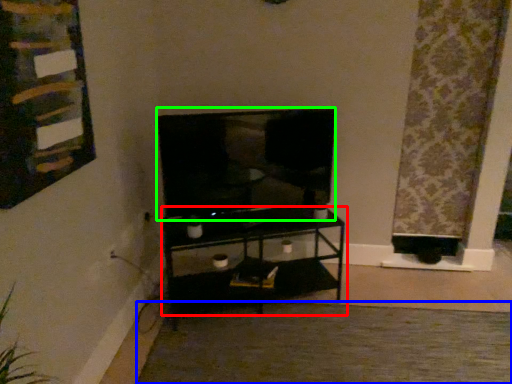
Question: Estimate the real-world distances between objects in this image. Which object is closer to shelf (highlighted by a red box), plain (highlighted by a blue box) or television (highlighted by a green box)?

Choices:
 (A) plain
 (B) television

Answer: (B)